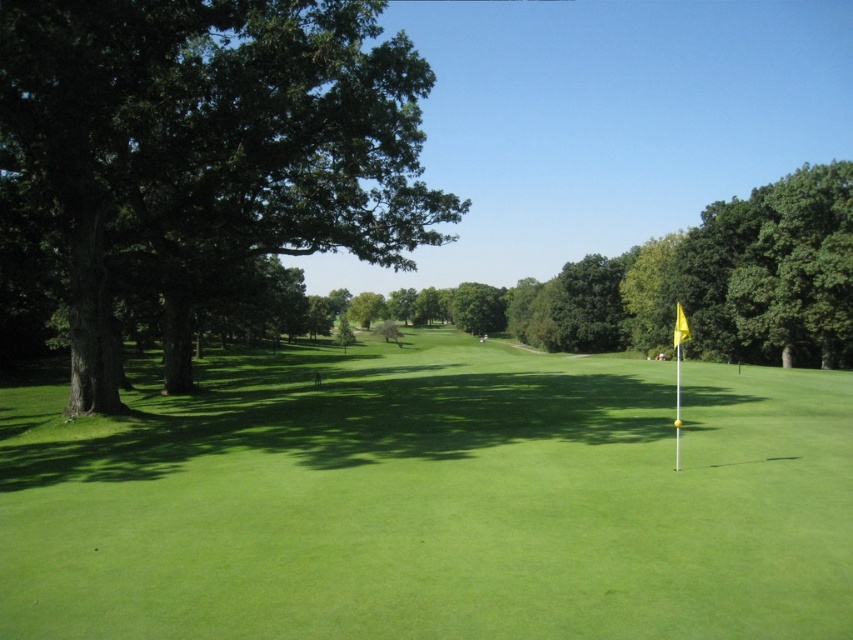
You are a golfer standing at the point marked by the yellow flag and white pole on the right side of the fairway. You want to hit a ball to the point at coordinates [432,500]. Based on the scene description, will your ball land on the green grassy golf course at center?

Yes, the point at coordinates [432,500] is located on the green grassy golf course at center, so the ball will land there.

You are a golfer standing on the green grassy golf course at center and want to hit a ball towards the dark green leafy tree at left. Considering the space each occupies, which object will the ball most likely hit first?

The dark green leafy tree at left occupies more space than the green grassy golf course at center, so the ball will most likely hit the dark green leafy tree at left first.

You are a golfer standing on the green grassy golf course at center and want to hit the ball towards the green leafy tree at center. Considering the space between them, will the ball have enough room to pass through without hitting any obstacles?

The green grassy golf course at center has a lesser width compared to the green leafy tree at center, so the ball may not have enough space to pass through without potentially hitting the tree. Adjust your shot to ensure clearance.